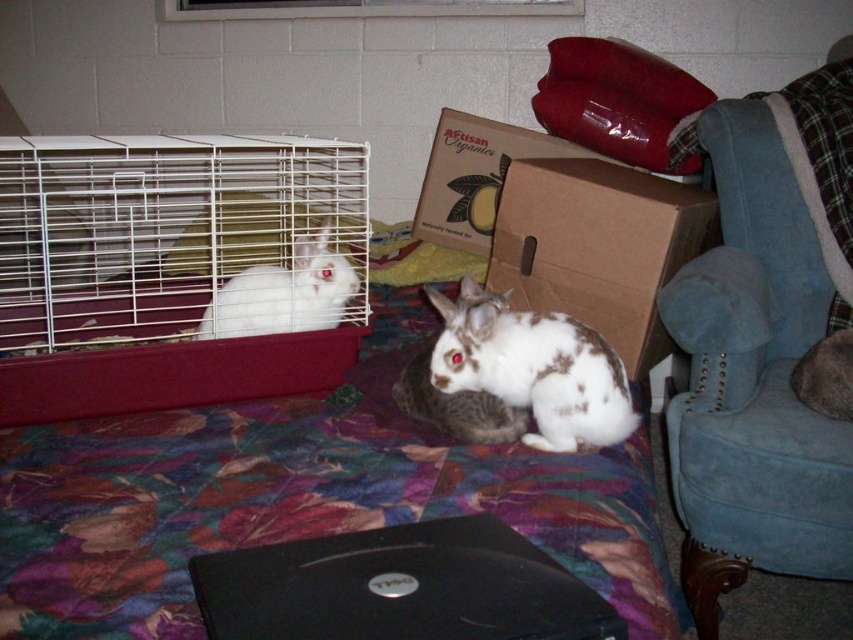
Question: Estimate the real-world distances between objects in this image. Which object is closer to the blue velvet armchair at right?

Choices:
 (A) brown cardboard box at center
 (B) cardboard box at upper center
 (C) white wire cage at left

Answer: (A)

Question: Which object appears farthest from the camera in this image?

Choices:
 (A) blue velvet armchair at right
 (B) white fur rabbit at left

Answer: (B)

Question: Which object appears closest to the camera in this image?

Choices:
 (A) white wire cage at left
 (B) brown cardboard box at center
 (C) cardboard box at upper center

Answer: (A)

Question: Is white wire cage at left smaller than cardboard box at upper center?

Choices:
 (A) yes
 (B) no

Answer: (B)

Question: Can you confirm if blue velvet armchair at right is positioned above white fur rabbit at left?

Choices:
 (A) no
 (B) yes

Answer: (A)

Question: Is brown cardboard box at center closer to the viewer compared to white fur rabbit at left?

Choices:
 (A) yes
 (B) no

Answer: (B)